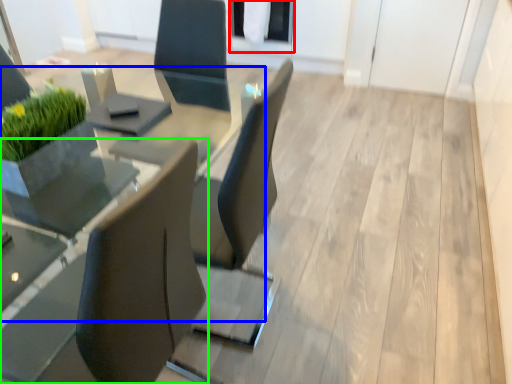
Question: Which object is the closest to the glass door (highlighted by a red box)? Choose among these: round table (highlighted by a blue box) or chair (highlighted by a green box).

Choices:
 (A) round table
 (B) chair

Answer: (A)